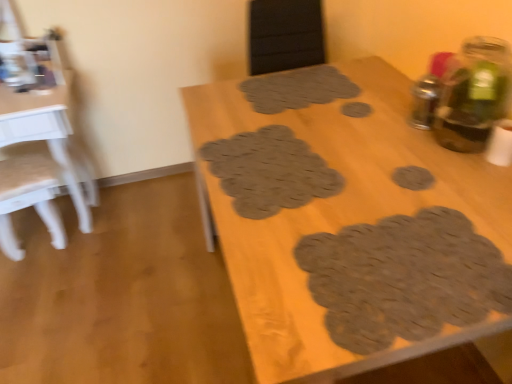
Find the location of a particular element. This screenshot has width=512, height=384. free space in front of green glass bottle at upper right, the 2th bottle from the back is located at coordinates (472, 184).